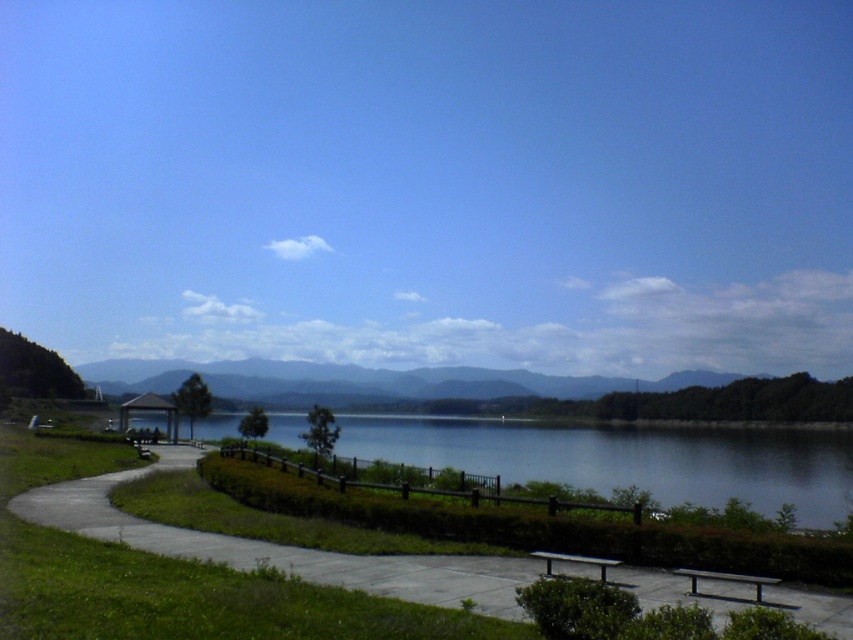
Question: Among these points, which one is nearest to the camera?

Choices:
 (A) (544, 570)
 (B) (212, 548)
 (C) (759, 600)
 (D) (561, 474)

Answer: (C)

Question: Can you confirm if concrete at center is positioned above wooden park bench at lower center?

Choices:
 (A) no
 (B) yes

Answer: (A)

Question: Which of these objects is positioned farthest from the blue glassy water at center?

Choices:
 (A) wooden bench at lower right
 (B) wooden park bench at lower center

Answer: (B)

Question: Can you confirm if blue glassy water at center is wider than concrete at center?

Choices:
 (A) yes
 (B) no

Answer: (A)

Question: Which point is closer to the camera?

Choices:
 (A) (241, 560)
 (B) (689, 573)

Answer: (B)

Question: Can you confirm if blue glassy water at center is smaller than wooden park bench at lower center?

Choices:
 (A) no
 (B) yes

Answer: (A)